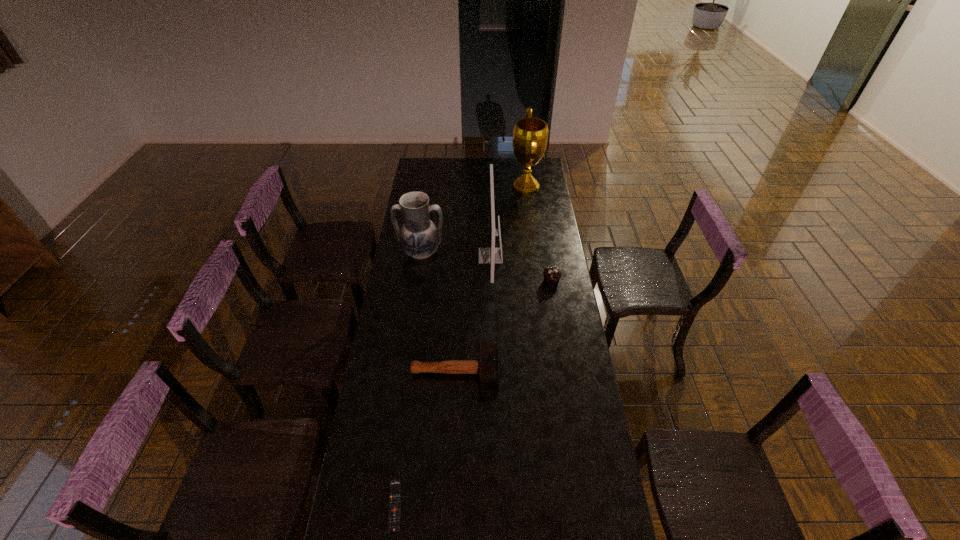
The height and width of the screenshot is (540, 960). Find the location of `the farthest object`. the farthest object is located at coordinates (530, 135).

Locate an element on the screen. monitor is located at coordinates (491, 255).

You are a GUI agent. You are given a task and a screenshot of the screen. Output one action in this format:
    pyautogui.click(x=<x>, y=<y>)
    Task: Click on the pitcher
    
    Given the screenshot: What is the action you would take?
    pyautogui.click(x=419, y=237)

The height and width of the screenshot is (540, 960). I want to click on cupcake, so click(x=552, y=275).

Find the location of a particular element. This screenshot has height=540, width=960. the fifth farthest object is located at coordinates (487, 367).

Where is `the second shortest object`? the second shortest object is located at coordinates (487, 367).

This screenshot has width=960, height=540. Identify the location of the nearest object. (394, 514).

Identify the location of the shortest object. Image resolution: width=960 pixels, height=540 pixels. (394, 514).

You are a GUI agent. You are given a task and a screenshot of the screen. Output one action in this format:
    pyautogui.click(x=<x>, y=<y>)
    Task: Click on the free space located 0.140m on the front-facing side of the award
    This screenshot has height=540, width=960.
    Given the screenshot: What is the action you would take?
    pyautogui.click(x=486, y=186)

At what (x,y) coordinates should I click in order to perform the action: click on vacant area located on the front-facing side of the award. Please return your answer as a coordinate pair (x, y). Looking at the image, I should click on (490, 186).